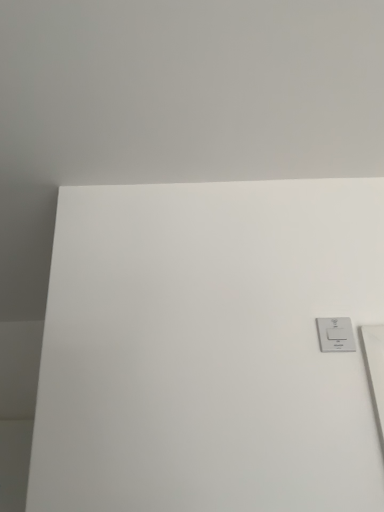
The width and height of the screenshot is (384, 512). Find the location of `white plastic light switch at lower right`. white plastic light switch at lower right is located at coordinates (335, 335).

The image size is (384, 512). Describe the element at coordinates (335, 335) in the screenshot. I see `white plastic light switch at lower right` at that location.

In order to click on white plastic light switch at lower right in this screenshot , I will do `click(335, 335)`.